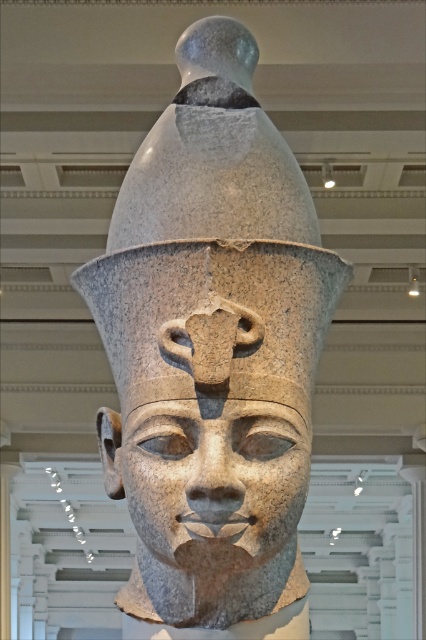
You are an archaeologist standing in front of the ancient Egyptian statue. You need to place a protective barrier around the statue. Where should you place it to ensure it covers the granite statue at center?

The protective barrier should be placed at point [213,365] to cover the granite statue at center.